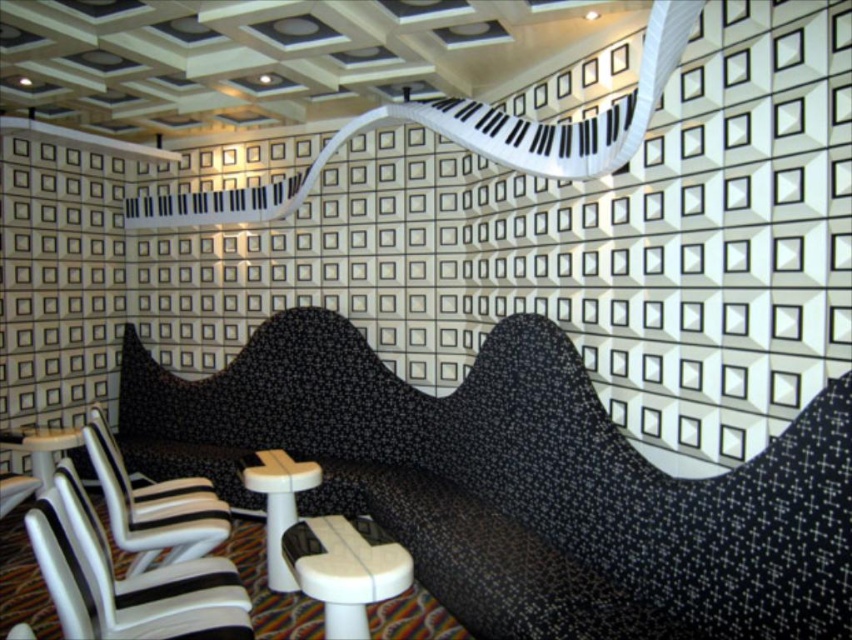
You are planning to host a small event in this space and need to seat two guests. You have a white textured chair at lower left and a white leather chair at lower left. Which chair can accommodate a larger guest comfortably?

The white textured chair at lower left is larger in size than the white leather chair at lower left, so it can accommodate a larger guest more comfortably.

You are planning to host a small gathering and need to seat two people in the room. You have two chairs available, the white textured chair at lower left and the white leather chair at lower left. If you want to maximize the seating space, which chair should you choose?

The white textured chair at lower left has a larger width than the white leather chair at lower left, so choosing the white textured chair at lower left will allow for more seating space.